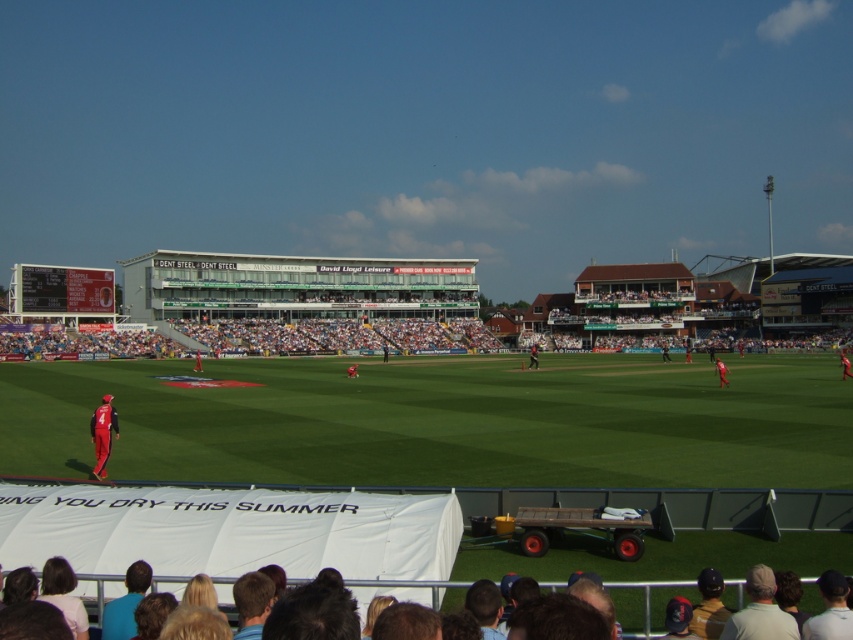
Which of these two, dark blue helmet at lower right or orange fabric person at center, stands taller?

With more height is orange fabric person at center.

From the picture: Is dark blue helmet at lower right below orange fabric person at center?

Yes, dark blue helmet at lower right is below orange fabric person at center.

Where is `dark blue helmet at lower right`? dark blue helmet at lower right is located at coordinates (709, 605).

The height and width of the screenshot is (640, 853). In order to click on dark blue helmet at lower right in this screenshot , I will do click(709, 605).

Does dark blue fabric cap at lower right have a greater height compared to orange fabric person at center?

In fact, dark blue fabric cap at lower right may be shorter than orange fabric person at center.

Which is below, dark blue fabric cap at lower right or orange fabric person at center?

orange fabric person at center

Does point (831, 577) lie in front of point (721, 374)?

Yes, it is in front of point (721, 374).

Identify the location of dark blue fabric cap at lower right. (830, 611).

Does point (819, 632) come in front of point (103, 449)?

Yes, it is in front of point (103, 449).

Can you confirm if dark blue fabric cap at lower right is positioned to the right of matte red uniform at lower left?

Indeed, dark blue fabric cap at lower right is positioned on the right side of matte red uniform at lower left.

Does point (840, 608) come behind point (108, 426)?

No.

Image resolution: width=853 pixels, height=640 pixels. Find the location of `dark blue fabric cap at lower right`. dark blue fabric cap at lower right is located at coordinates (830, 611).